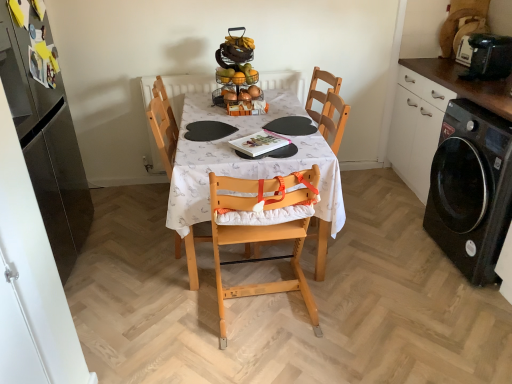
The height and width of the screenshot is (384, 512). Identify the location of vacant area that lies to the right of white fabric table at center. (391, 244).